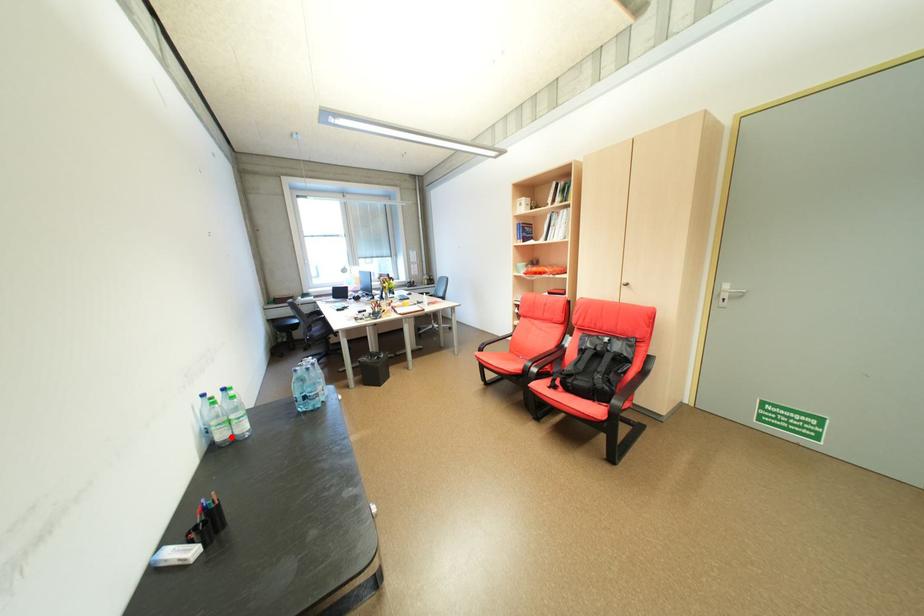
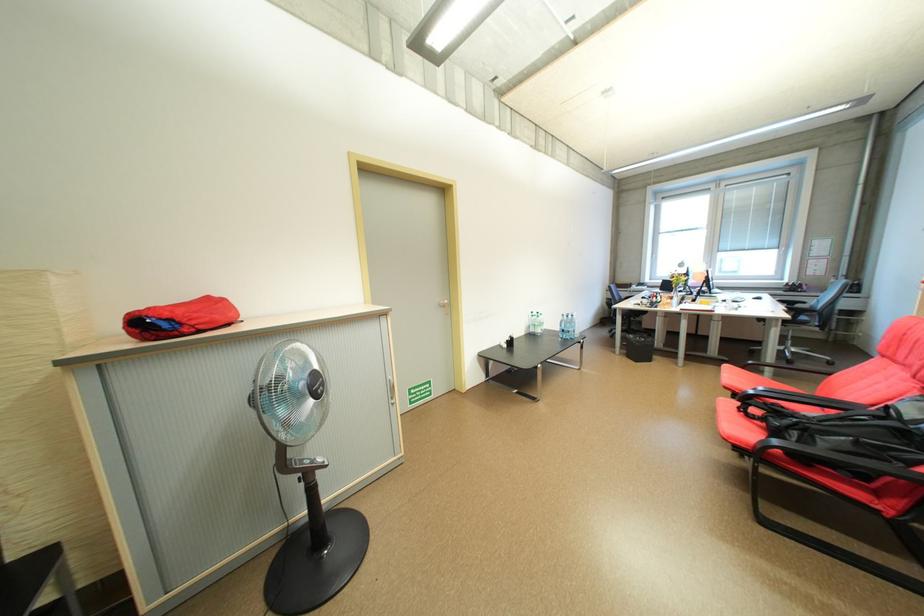
Question: A red point is marked in image1. In image2, is the corresponding 3D point closer to the camera or farther? Reply with the corresponding letter.

Choices:
 (A) The corresponding 3D point is closer.
 (B) The corresponding 3D point is farther.

Answer: (B)